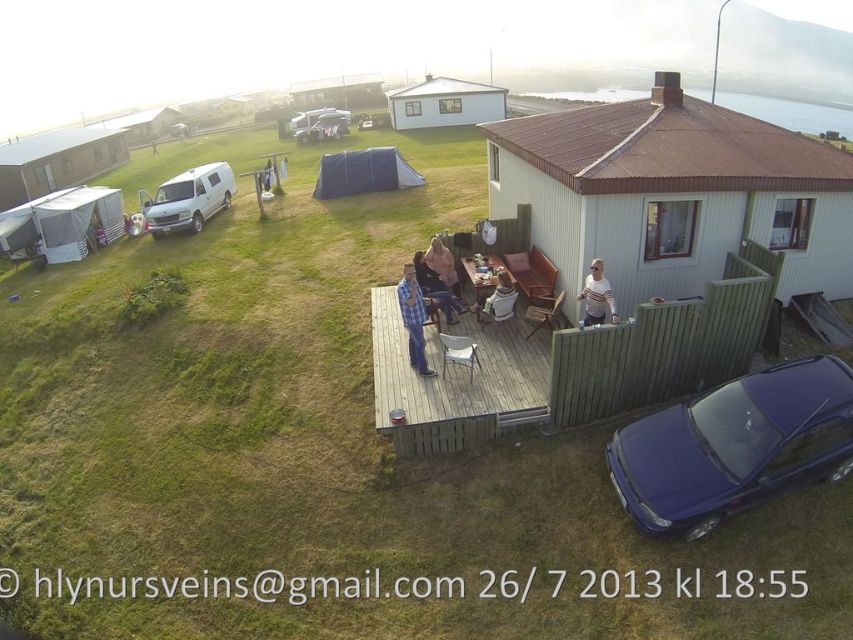
You are standing on the wooden deck and want to walk towards the point that is closer to you. Which point should you walk towards, point (376, 305) or point (611, 298)?

You should walk towards point (376, 305) because it is closer to you than point (611, 298).

You are standing on the wooden deck at center and want to pass the white striped shirt at upper right. Is there enough space to walk through?

The wooden deck at center might be wider than white striped shirt at upper right, so there is likely enough space to walk through.